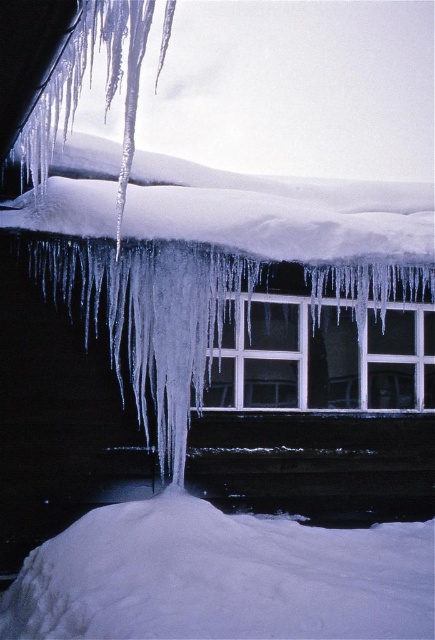
Can you confirm if white fluffy snow at lower center is positioned above white matte window at center?

Actually, white fluffy snow at lower center is below white matte window at center.

Consider the image. Who is more forward, (178, 579) or (374, 307)?

Point (178, 579) is more forward.

Does point (63, 544) come closer to viewer compared to point (311, 324)?

Yes, point (63, 544) is in front of point (311, 324).

Where is `white fluffy snow at lower center`? Image resolution: width=435 pixels, height=640 pixels. white fluffy snow at lower center is located at coordinates (220, 577).